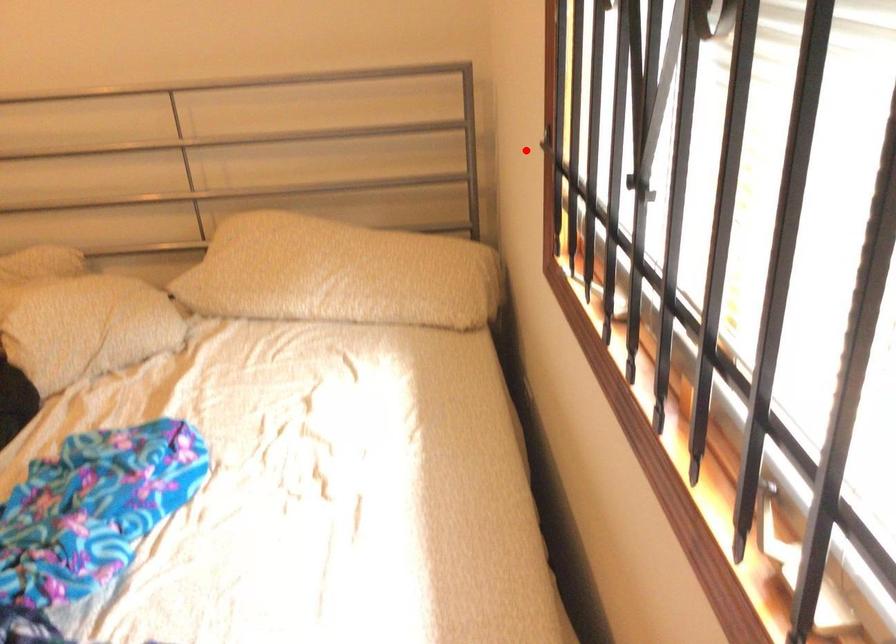
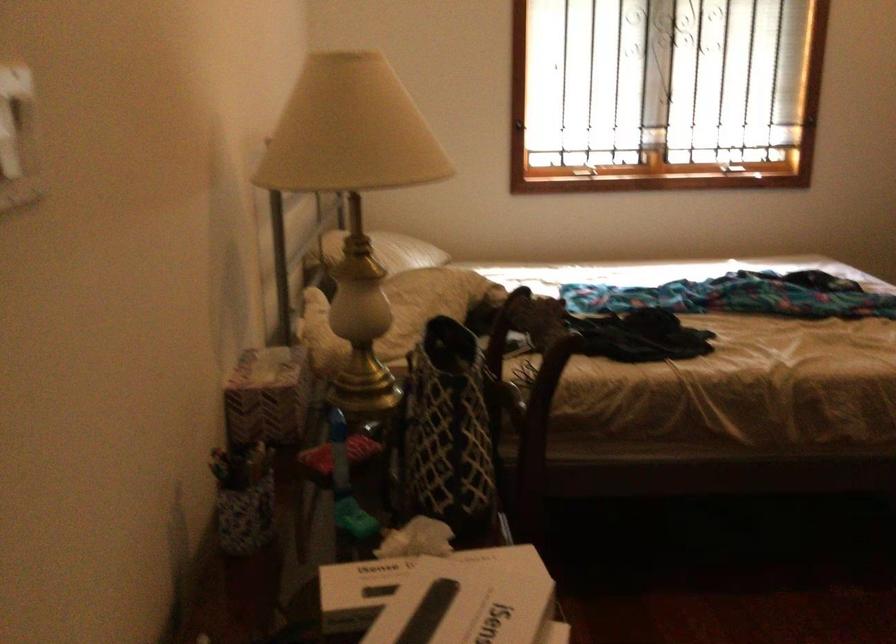
Question: A red point is marked in image1. In image2, is the corresponding 3D point closer to the camera or farther? Reply with the corresponding letter.

Choices:
 (A) The corresponding 3D point is closer.
 (B) The corresponding 3D point is farther.

Answer: (B)